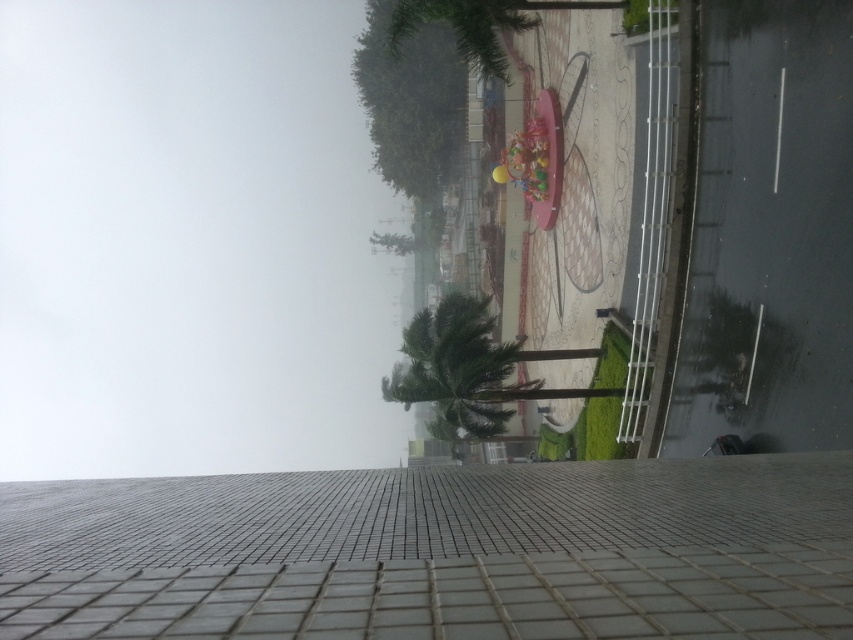
You are standing on the tiled surface in the foreground and want to walk towards the clock face design in the middle ground. Which object, the gray tile pavement at center or the green leafy palm tree at center, is directly in your path?

The gray tile pavement at center is directly in your path because it is located above the green leafy palm tree at center, meaning it is closer to you.

You are standing at the camera position and want to reach the point marked at coordinates [167,348]. Considering the camera is 156.30 meters away from this point, can you estimate how far you need to walk to reach it?

The point marked at coordinates [167,348] is 156.30 meters away from the camera, so you would need to walk approximately 156.30 meters to reach it.